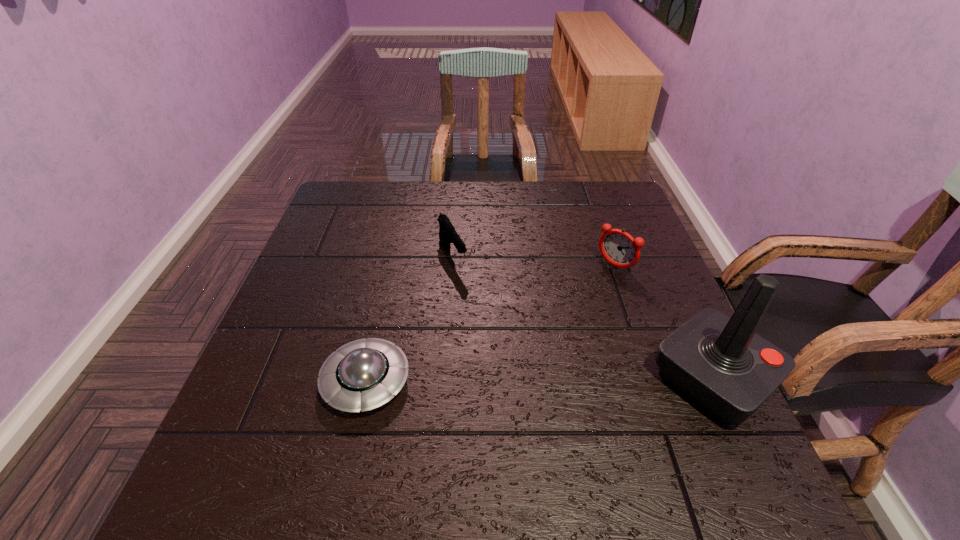
Identify the location of vacant point located on the front-facing side of the alarm clock. click(582, 298).

Identify the location of vacant point located 0.160m on the front-facing side of the third object from right to left. (485, 318).

The image size is (960, 540). I want to click on free location located on the front-facing side of the third object from right to left, so click(x=481, y=312).

Where is `free space located 0.280m on the front-facing side of the third object from right to left`? The width and height of the screenshot is (960, 540). free space located 0.280m on the front-facing side of the third object from right to left is located at coordinates (509, 359).

Find the location of a particular element. The width and height of the screenshot is (960, 540). saucer located at the near edge is located at coordinates (364, 374).

You are a GUI agent. You are given a task and a screenshot of the screen. Output one action in this format:
    pyautogui.click(x=<x>, y=<y>)
    Task: Click on the joystick located in the near edge section of the desktop
    Image resolution: width=960 pixels, height=540 pixels.
    Given the screenshot: What is the action you would take?
    pyautogui.click(x=719, y=362)

Find the location of a particular element. This screenshot has height=540, width=960. object located in the left edge section of the desktop is located at coordinates (364, 374).

Identify the location of joystick that is at the right edge. The width and height of the screenshot is (960, 540). pos(719,362).

Locate an element on the screen. alarm clock that is at the right edge is located at coordinates (617, 247).

The width and height of the screenshot is (960, 540). Find the location of `object present at the near left corner`. object present at the near left corner is located at coordinates (364, 374).